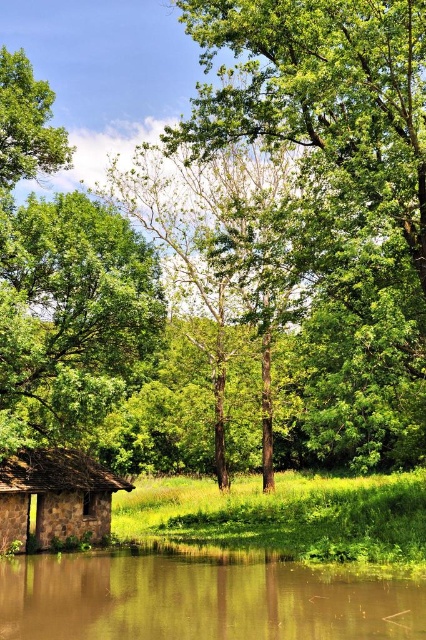
You are planning to place a picnic blanket between the green leafy tree at center and the stone hut at lower left. The picnic blanket requires a space of 10 meters between the two objects to be placed comfortably. Is there enough space?

The green leafy tree at center and the stone hut at lower left are 12.11 meters apart from each other, which is more than the required 10 meters, so there is enough space to place the picnic blanket comfortably between them.